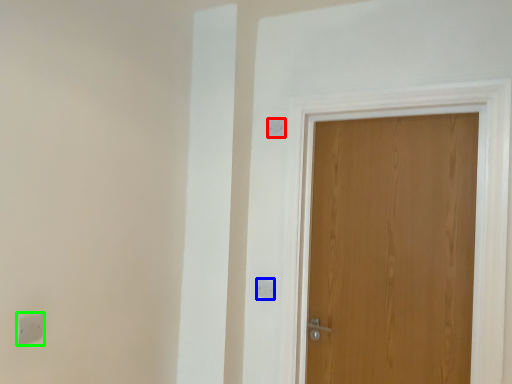
Question: Based on their relative distances, which object is farther from light switch (highlighted by a red box)? Choose from light switch (highlighted by a blue box) and light switch (highlighted by a green box).

Choices:
 (A) light switch
 (B) light switch

Answer: (B)